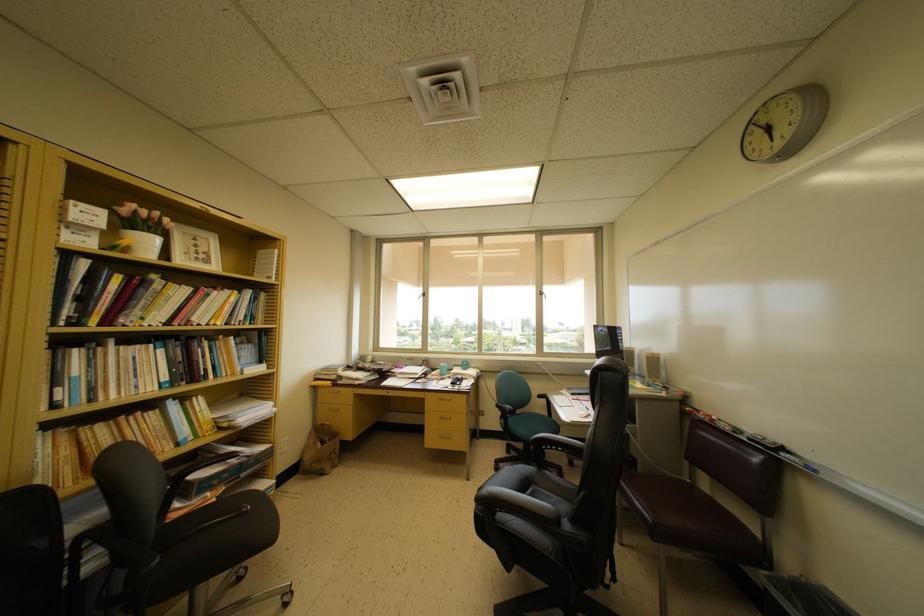
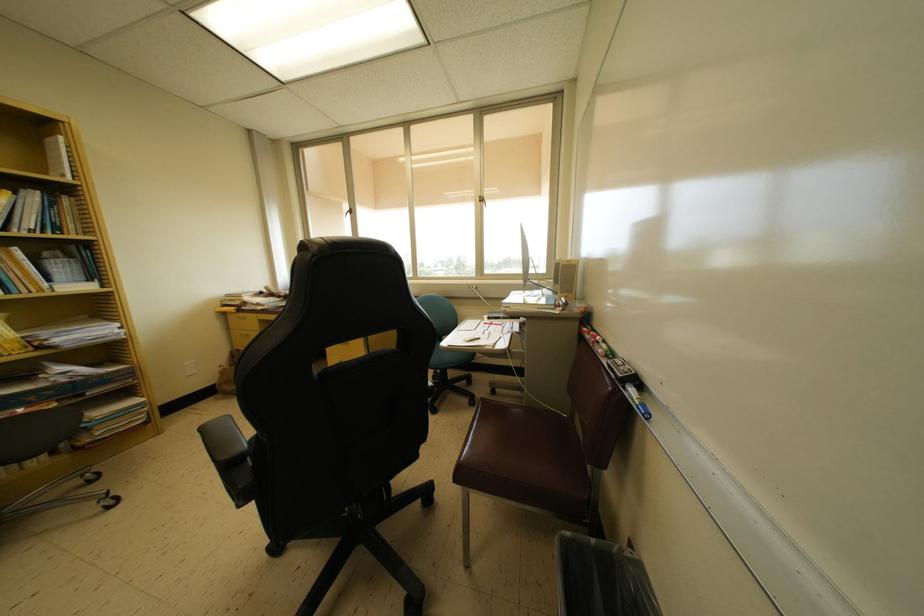
Find the pixel in the second image that matches point 225,363 in the first image.

(15, 278)